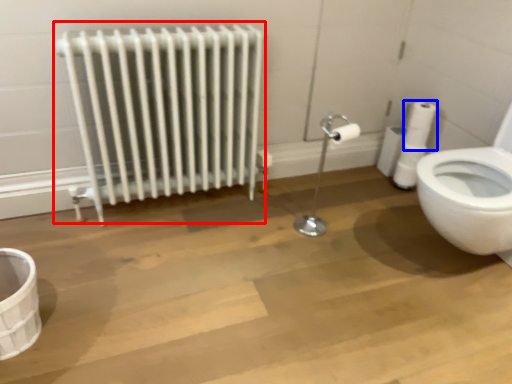
Question: Which object is further to the camera taking this photo, radiator (highlighted by a red box) or toilet paper (highlighted by a blue box)?

Choices:
 (A) radiator
 (B) toilet paper

Answer: (B)